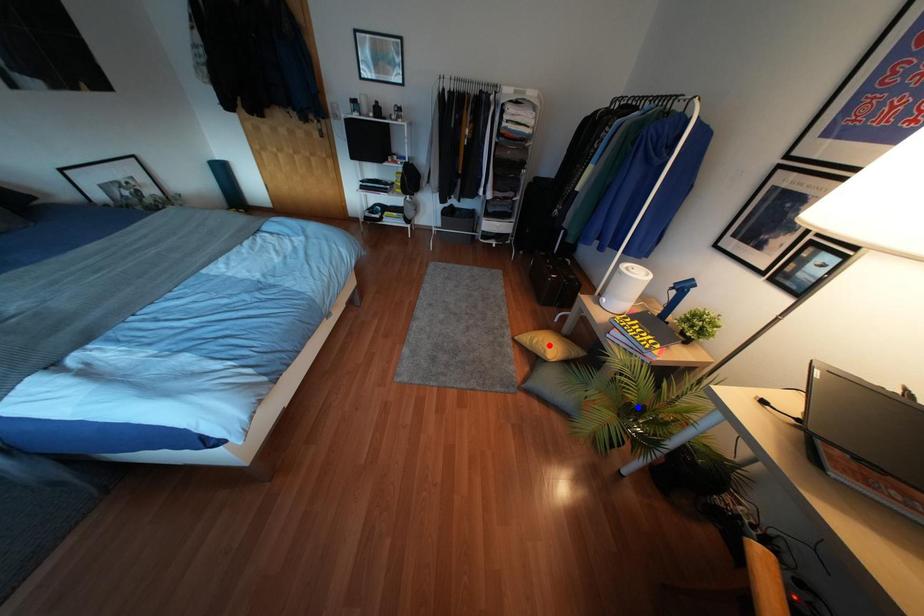
Question: In the image, two points are highlighted. Which point is nearer to the camera? Reply with the corresponding letter.

Choices:
 (A) blue point
 (B) red point

Answer: (A)